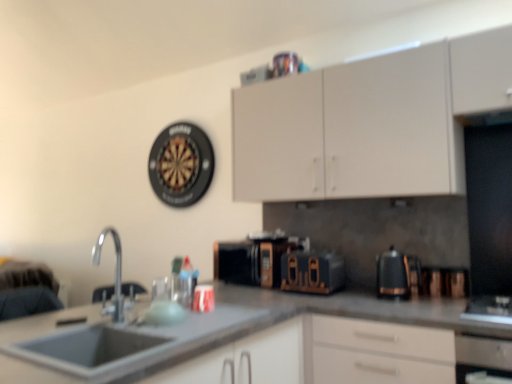
Where is `free location to the left of silver metallic faucet at lower left`? This screenshot has height=384, width=512. free location to the left of silver metallic faucet at lower left is located at coordinates (64, 331).